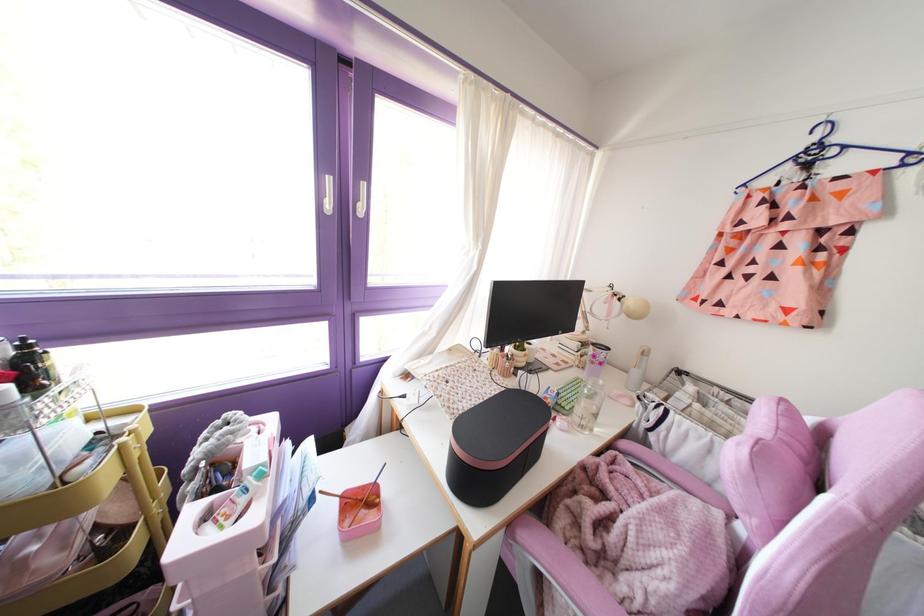
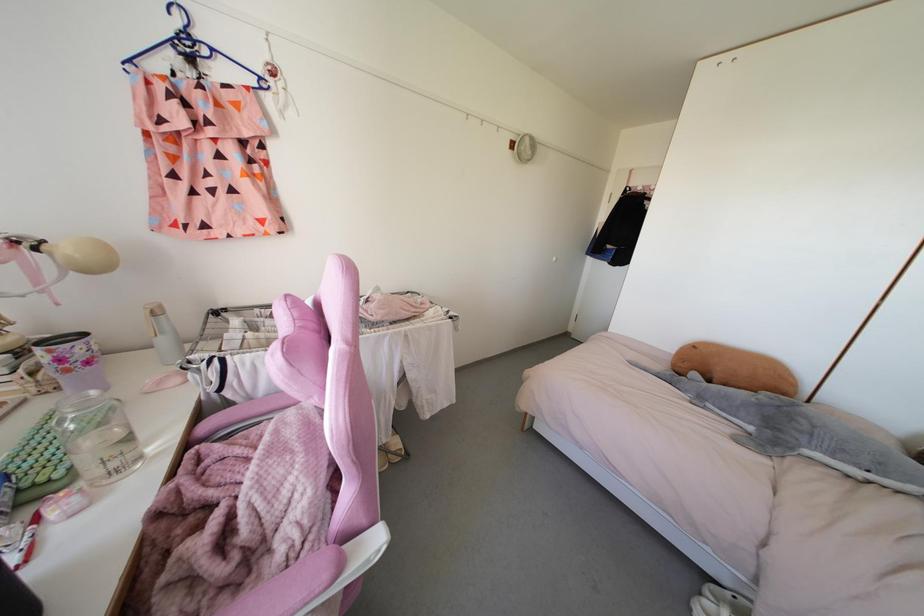
The first image is from the beginning of the video and the second image is from the end. How did the camera likely rotate when shooting the video?

The camera's rotation is toward right-down.